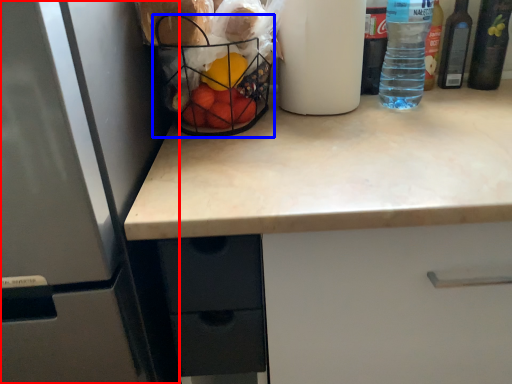
Question: Which object appears closest to the camera in this image, refrigerator (highlighted by a red box) or basket (highlighted by a blue box)?

Choices:
 (A) refrigerator
 (B) basket

Answer: (A)